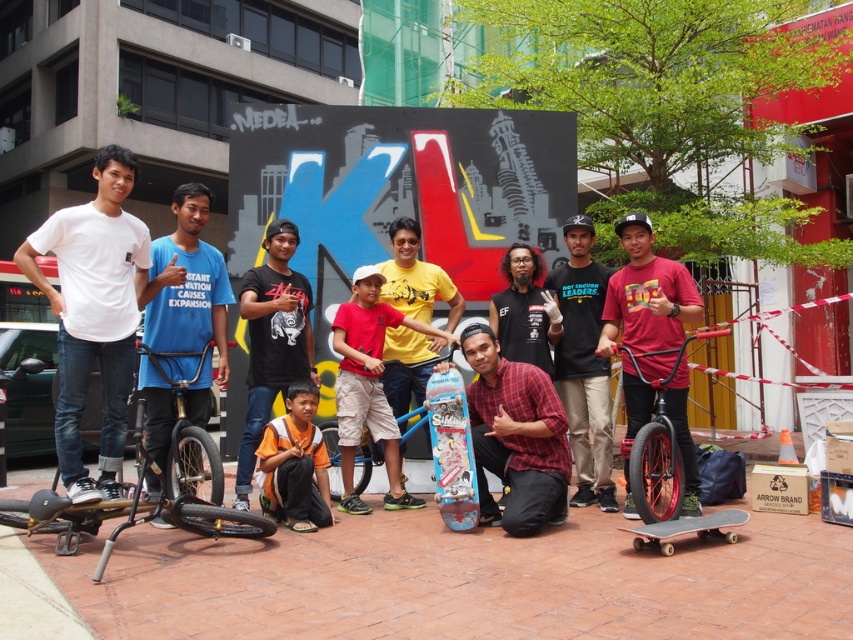
Between black matte bicycle at lower left and black matte shirt at center, which one is positioned higher?

black matte shirt at center is above.

Locate an element on the screen. Image resolution: width=853 pixels, height=640 pixels. black matte bicycle at lower left is located at coordinates (148, 499).

Does point (30, 531) come in front of point (579, 369)?

Yes, it is.

Where is `black matte bicycle at lower left`? black matte bicycle at lower left is located at coordinates (148, 499).

Who is more forward, (212, 509) or (253, 392)?

Point (212, 509) is more forward.

Consider the image. Does black matte bicycle at lower left have a smaller size compared to orange t-shirt at center?

No.

Is point (193, 352) less distant than point (247, 448)?

Yes, it is in front of point (247, 448).

Identify the location of black matte bicycle at lower left. (148, 499).

In the scene shown: Who is more forward, (201, 323) or (566, 410)?

Positioned in front is point (201, 323).

Can you confirm if blue matte shirt at center is bigger than black matte shirt at center?

Correct, blue matte shirt at center is larger in size than black matte shirt at center.

Does point (148, 273) come farther from viewer compared to point (566, 237)?

No, (148, 273) is closer to viewer.

Locate an element on the screen. The height and width of the screenshot is (640, 853). blue matte shirt at center is located at coordinates (187, 284).